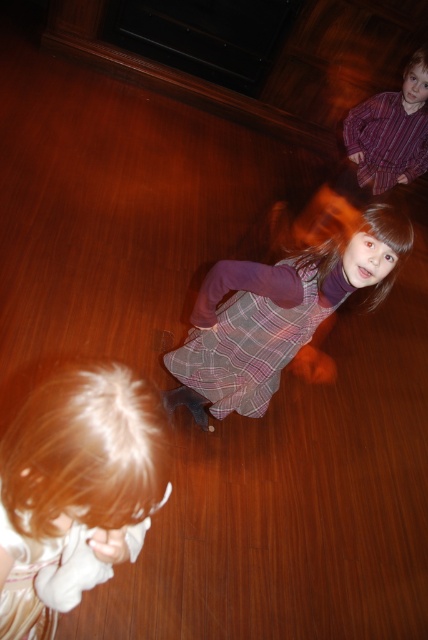
Question: Which object is positioned closest to the blonde hair at lower left?

Choices:
 (A) striped cotton shirt at upper right
 (B) plaid fabric dress at center
 (C) white cotton dress at lower left

Answer: (C)

Question: Which of the following is the closest to the observer?

Choices:
 (A) (356, 259)
 (B) (125, 472)

Answer: (B)

Question: Based on their relative distances, which object is farther from the blonde hair at lower left?

Choices:
 (A) striped cotton shirt at upper right
 (B) plaid fabric dress at center

Answer: (A)

Question: Can you confirm if plaid fabric dress at center is positioned to the left of striped cotton shirt at upper right?

Choices:
 (A) yes
 (B) no

Answer: (A)

Question: Is the position of blonde hair at lower left less distant than that of striped cotton shirt at upper right?

Choices:
 (A) yes
 (B) no

Answer: (A)

Question: Does blonde hair at lower left appear on the left side of plaid fabric dress at center?

Choices:
 (A) no
 (B) yes

Answer: (B)